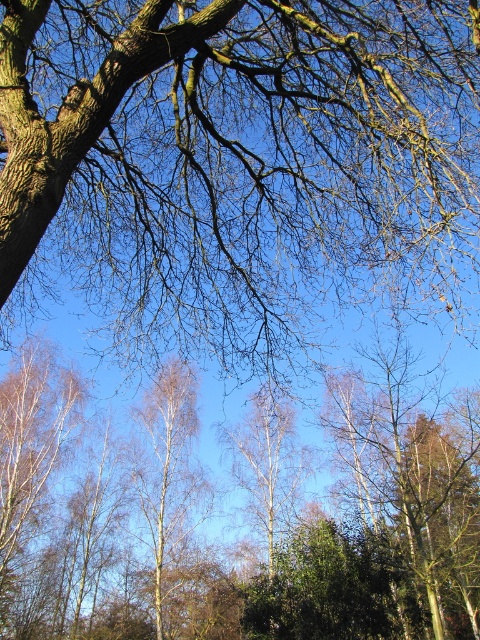
Question: Among these points, which one is nearest to the camera?

Choices:
 (A) (180, 76)
 (B) (186, 529)

Answer: (A)

Question: Does brown rough bark tree at upper left appear over white smooth birch tree at center?

Choices:
 (A) yes
 (B) no

Answer: (A)

Question: Does brown rough bark tree at upper left have a greater width compared to white smooth birch tree at center?

Choices:
 (A) yes
 (B) no

Answer: (A)

Question: Which of the following is the farthest from the observer?

Choices:
 (A) brown rough bark tree at upper left
 (B) white smooth birch tree at center

Answer: (B)

Question: Which point appears farthest from the camera in this image?

Choices:
 (A) (170, 508)
 (B) (377, 44)

Answer: (A)

Question: Can you confirm if brown rough bark tree at upper left is wider than white smooth birch tree at center?

Choices:
 (A) yes
 (B) no

Answer: (A)